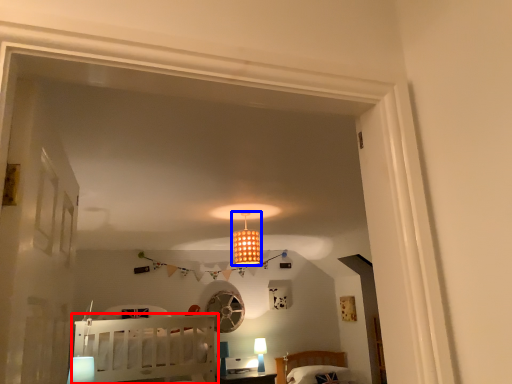
Question: Among these objects, which one is nearest to the camera, furniture (highlighted by a red box) or lamp (highlighted by a blue box)?

Choices:
 (A) furniture
 (B) lamp

Answer: (A)